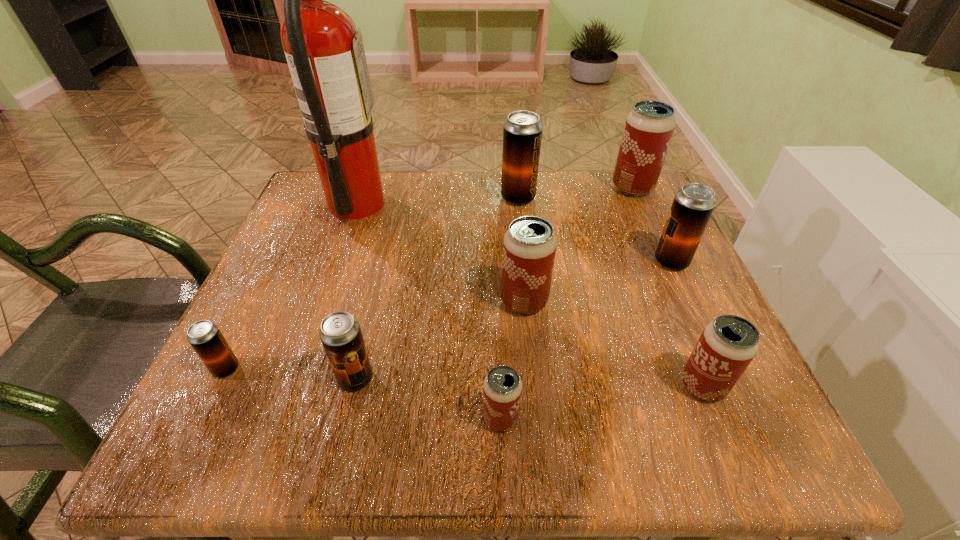
The height and width of the screenshot is (540, 960). Identify the location of the fourth closest black beer can to the biggest red beer can. (206, 339).

Point out which red beer can is positioned as the third nearest to the smallest red beer can. Please provide its 2D coordinates. Your answer should be formatted as a tuple, i.e. [(x, y)], where the tuple contains the x and y coordinates of a point satisfying the conditions above.

[(649, 127)]

The image size is (960, 540). Identify the location of red beer can identified as the closest to the third smallest red beer can. (502, 393).

Identify the location of blank area in the image that satisfies the following two spatial constraints: 1. on the nozzle side of the tallest object; 2. on the back side of the smallest red beer can. click(x=281, y=417).

The height and width of the screenshot is (540, 960). What are the coordinates of `free spot that satisfies the following two spatial constraints: 1. on the back side of the third biggest black beer can; 2. on the nozzle side of the fire extinguisher` in the screenshot? It's located at (396, 204).

This screenshot has height=540, width=960. I want to click on vacant area that satisfies the following two spatial constraints: 1. on the nozzle side of the tallest object; 2. on the left side of the smallest red beer can, so click(281, 417).

You are a GUI agent. You are given a task and a screenshot of the screen. Output one action in this format:
    pyautogui.click(x=<x>, y=<y>)
    Task: Click on the vacant space that satisfies the following two spatial constraints: 1. on the back side of the second black beer can from left to right; 2. on the nozzle side of the tallest object
    
    Given the screenshot: What is the action you would take?
    pyautogui.click(x=396, y=204)

You are a GUI agent. You are given a task and a screenshot of the screen. Output one action in this format:
    pyautogui.click(x=<x>, y=<y>)
    Task: Click on the free point that satisfies the following two spatial constraints: 1. on the front side of the biggest red beer can; 2. on the right side of the second farthest black beer can
    This screenshot has width=960, height=540.
    Given the screenshot: What is the action you would take?
    coord(666,261)

This screenshot has height=540, width=960. I want to click on free space that satisfies the following two spatial constraints: 1. on the back side of the smallest red beer can; 2. on the nozzle side of the red fire extinguisher, so click(492, 204).

At what (x,y) coordinates should I click in order to perform the action: click on vacant space that satisfies the following two spatial constraints: 1. on the back side of the second smallest red beer can; 2. on the nozzle side of the fire extinguisher. Please return your answer as a coordinate pair (x, y). The image size is (960, 540). Looking at the image, I should click on (627, 204).